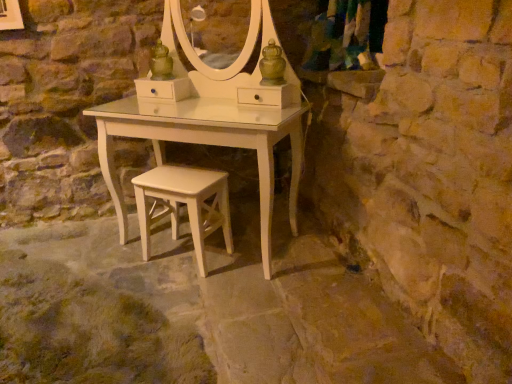
Image resolution: width=512 pixels, height=384 pixels. What are the coordinates of `vacant space underneath light beige wood stool at center (from a real-world perspective)` in the screenshot? It's located at (183, 262).